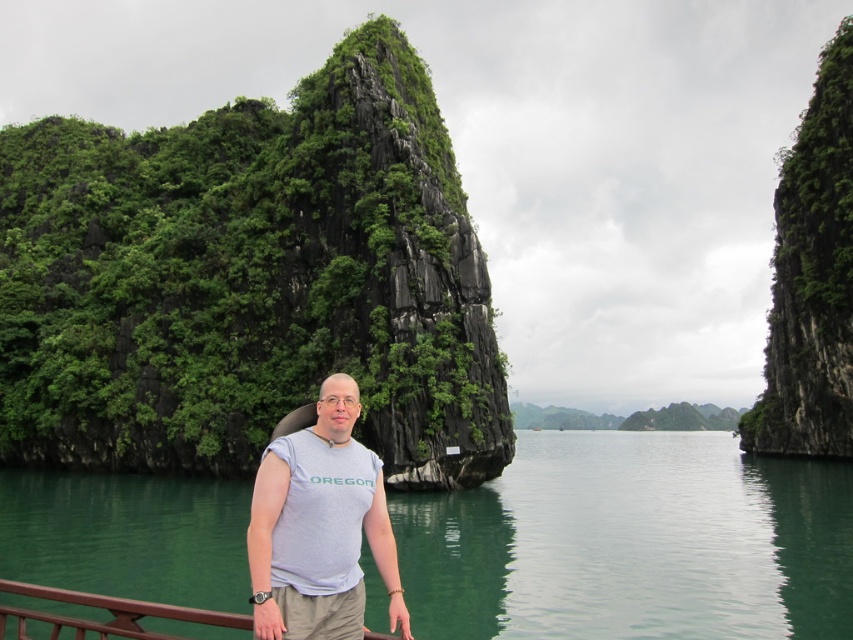
Is gray cotton t-shirt at center to the left of brown wood at lower left from the viewer's perspective?

No, gray cotton t-shirt at center is not to the left of brown wood at lower left.

Is gray cotton t-shirt at center taller than brown wood at lower left?

Correct, gray cotton t-shirt at center is much taller as brown wood at lower left.

The height and width of the screenshot is (640, 853). I want to click on gray cotton t-shirt at center, so click(320, 522).

Is green lichen-covered rock at center closer to camera compared to brown wood at lower left?

No, it is behind brown wood at lower left.

Is point (163, 422) closer to viewer compared to point (218, 614)?

No, it is behind (218, 614).

Which is in front, point (273, 285) or point (3, 620)?

Positioned in front is point (3, 620).

Where is `green lichen-covered rock at center`? green lichen-covered rock at center is located at coordinates (x=250, y=280).

Does green lichen-covered rock at center appear on the left side of gray cotton t-shirt at center?

Correct, you'll find green lichen-covered rock at center to the left of gray cotton t-shirt at center.

Identify the location of green lichen-covered rock at center. (250, 280).